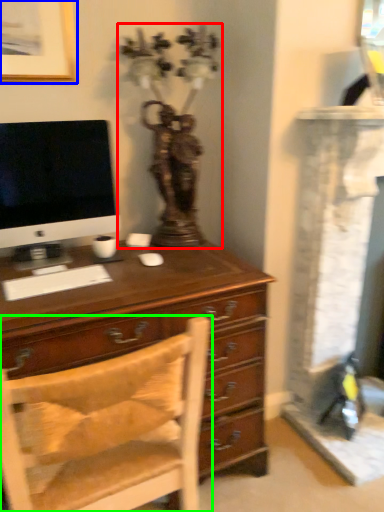
Question: Which object is positioned closest to antique (highlighted by a red box)? Select from picture frame (highlighted by a blue box) and chair (highlighted by a green box).

Choices:
 (A) picture frame
 (B) chair

Answer: (A)